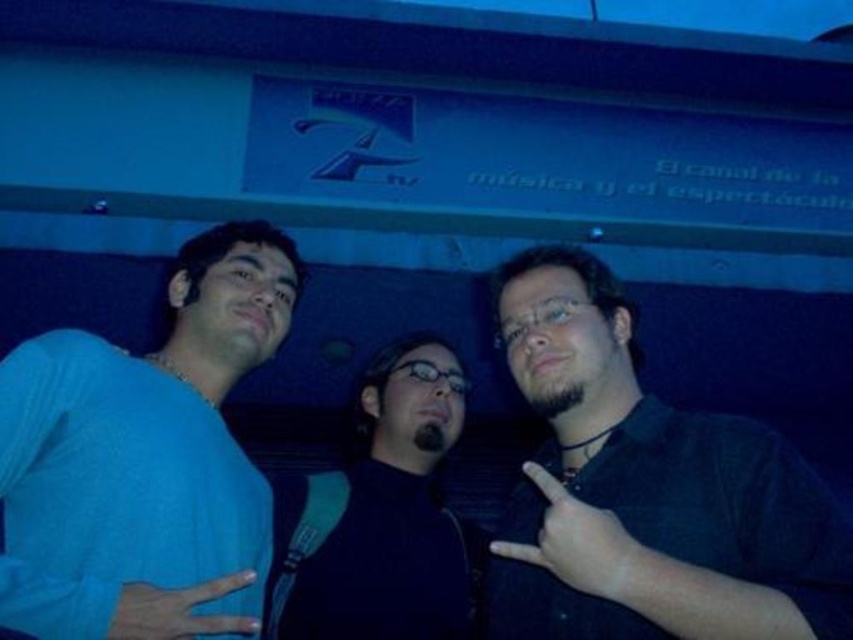
Question: Which object is the farthest from the blue matte shirt at left?

Choices:
 (A) black matte hand at center
 (B) matte blue hand at center
 (C) black matte glasses at center
 (D) dark green shirt at center

Answer: (D)

Question: Can you confirm if blue matte shirt at left is bigger than black matte hand at center?

Choices:
 (A) yes
 (B) no

Answer: (A)

Question: Can you confirm if blue matte shirt at left is bigger than black matte hand at center?

Choices:
 (A) yes
 (B) no

Answer: (A)

Question: Is black matte glasses at center to the left of matte blue hand at center from the viewer's perspective?

Choices:
 (A) yes
 (B) no

Answer: (B)

Question: Which point is closer to the camera?

Choices:
 (A) matte blue hand at center
 (B) black matte hand at center
 (C) dark green shirt at center

Answer: (C)

Question: Which object appears farthest from the camera in this image?

Choices:
 (A) matte blue hand at center
 (B) blue matte shirt at left
 (C) black matte glasses at center
 (D) dark green shirt at center

Answer: (C)